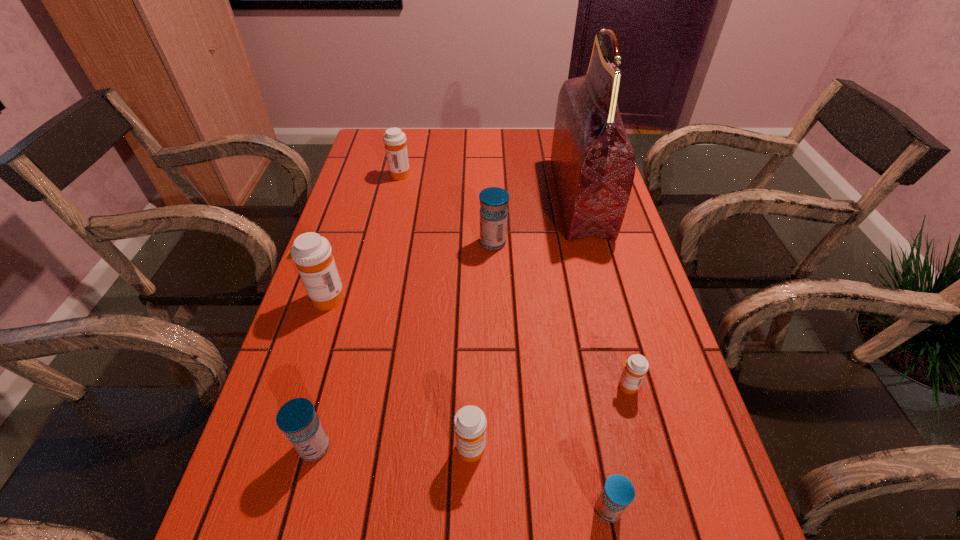
At what (x,y) coordinates should I click in order to perform the action: click on vacant region at the left edge. Please return your answer as a coordinate pair (x, y). Looking at the image, I should click on (348, 231).

Locate an element on the screen. The height and width of the screenshot is (540, 960). vacant space at the right edge of the desktop is located at coordinates click(619, 352).

Where is `vacant area at the far left corner of the desktop`? This screenshot has width=960, height=540. vacant area at the far left corner of the desktop is located at coordinates (374, 148).

What are the coordinates of `free space between the second orange medicine from right to left and the tallest object` in the screenshot? It's located at click(x=525, y=324).

This screenshot has width=960, height=540. Find the location of `empty space that is in between the rightmost blue medicine and the second nearest blue medicine`. empty space that is in between the rightmost blue medicine and the second nearest blue medicine is located at coordinates [x=461, y=478].

Where is `free area in between the fourth farthest medicine and the tallest medicine`? This screenshot has width=960, height=540. free area in between the fourth farthest medicine and the tallest medicine is located at coordinates (476, 342).

The height and width of the screenshot is (540, 960). I want to click on free space that is in between the nearest blue medicine and the second blue medicine from right to left, so click(550, 376).

You are a GUI agent. You are given a task and a screenshot of the screen. Output one action in this format:
    pyautogui.click(x=<x>, y=<y>)
    Task: Click on the vacant space that's between the nearest orange medicine and the second medicine from right to left
    The height and width of the screenshot is (540, 960).
    Given the screenshot: What is the action you would take?
    pyautogui.click(x=540, y=480)

Locate an element on the screen. free space that is in between the handbag and the third nearest orange medicine is located at coordinates (453, 248).

You are a GUI agent. You are given a task and a screenshot of the screen. Output one action in this format:
    pyautogui.click(x=<x>, y=<y>)
    Task: Click on the vacant space that is in between the handbag and the second medicine from right to left
    
    Given the screenshot: What is the action you would take?
    pyautogui.click(x=593, y=353)